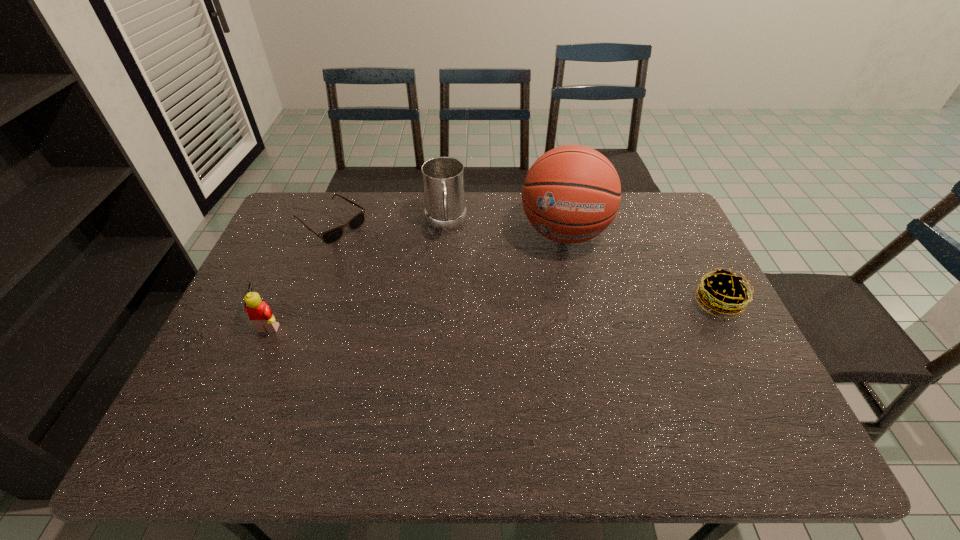
Locate an element on the screen. vacant space at the right edge is located at coordinates (707, 361).

Identify the location of free space at the far right corner of the desktop. The height and width of the screenshot is (540, 960). (638, 193).

Image resolution: width=960 pixels, height=540 pixels. What are the coordinates of `free space at the near right corner` in the screenshot? It's located at (724, 384).

You are a GUI agent. You are given a task and a screenshot of the screen. Output one action in this format:
    pyautogui.click(x=<x>, y=<y>)
    Task: Click on the free area in between the fourth tallest object and the basketball
    
    Given the screenshot: What is the action you would take?
    pyautogui.click(x=641, y=268)

Locate an element on the screen. empty space that is in between the second tallest object and the tallest object is located at coordinates (505, 228).

Identify the location of unoccupied position between the Lego and the rightmost object. (494, 313).

Image resolution: width=960 pixels, height=540 pixels. I want to click on vacant region between the third shortest object and the second shortest object, so click(494, 313).

Find the location of `vacant region between the fourth tallest object and the second tallest object`. vacant region between the fourth tallest object and the second tallest object is located at coordinates (582, 264).

This screenshot has width=960, height=540. What are the coordinates of `free space between the patty and the sunglasses` in the screenshot? It's located at (524, 264).

I want to click on vacant space that is in between the Lego and the tallest object, so click(418, 277).